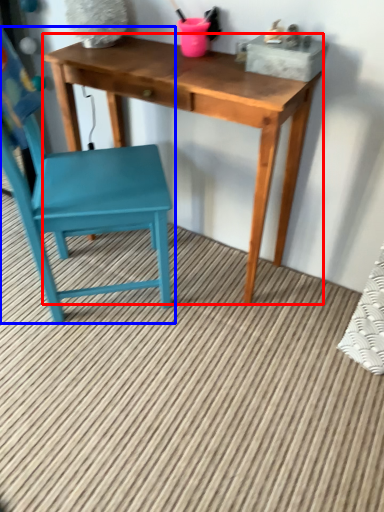
Question: Which point is closer to the camera, table (highlighted by a red box) or chair (highlighted by a blue box)?

Choices:
 (A) table
 (B) chair

Answer: (B)